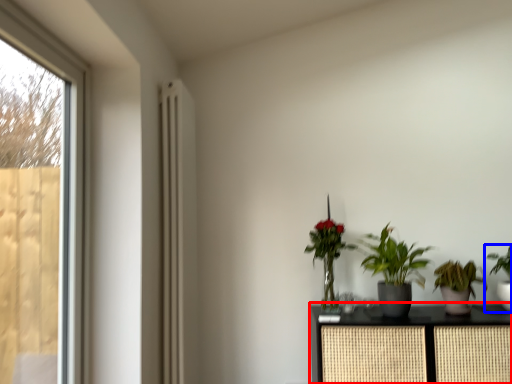
Question: Which of the following is the closest to the observer, furniture (highlighted by a red box) or houseplant (highlighted by a blue box)?

Choices:
 (A) furniture
 (B) houseplant

Answer: (A)